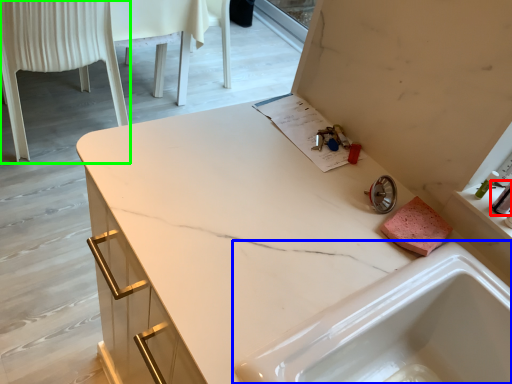
Question: Which is nearer to the toiletry (highlighted by a red box)? sink (highlighted by a blue box) or chair (highlighted by a green box).

Choices:
 (A) sink
 (B) chair

Answer: (A)